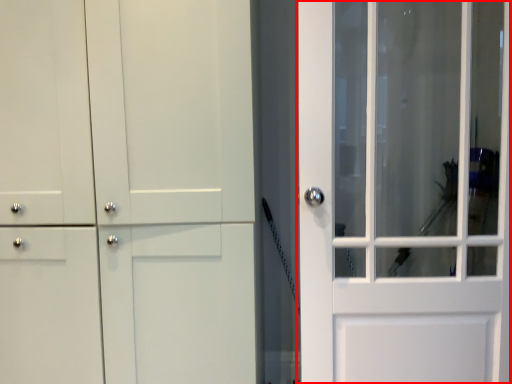
Question: Where is door (annotated by the red box) located in relation to barn door in the image?

Choices:
 (A) right
 (B) left

Answer: (A)